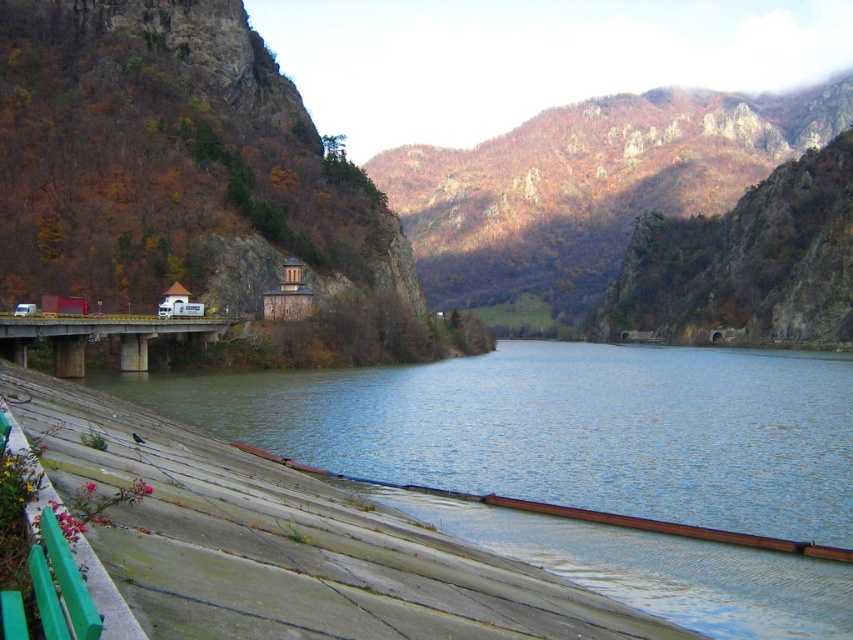
Between blue concrete river at lower left and concrete bridge at center, which one has less height?

blue concrete river at lower left is shorter.

This screenshot has width=853, height=640. Describe the element at coordinates (563, 428) in the screenshot. I see `blue concrete river at lower left` at that location.

Identify the location of blue concrete river at lower left. (563, 428).

Does blue concrete river at lower left have a lesser height compared to brown rocky mountain at center?

Correct, blue concrete river at lower left is not as tall as brown rocky mountain at center.

Who is more forward, [397,444] or [372,211]?

Point [397,444] is in front.

Between point (810, 472) and point (340, 269), which one is positioned behind?

Positioned behind is point (340, 269).

Identify the location of blue concrete river at lower left. The width and height of the screenshot is (853, 640). (563, 428).

Who is taller, brown rocky mountain at center or concrete bridge at center?

brown rocky mountain at center

This screenshot has height=640, width=853. In order to click on brown rocky mountain at center in this screenshot , I will do `click(167, 156)`.